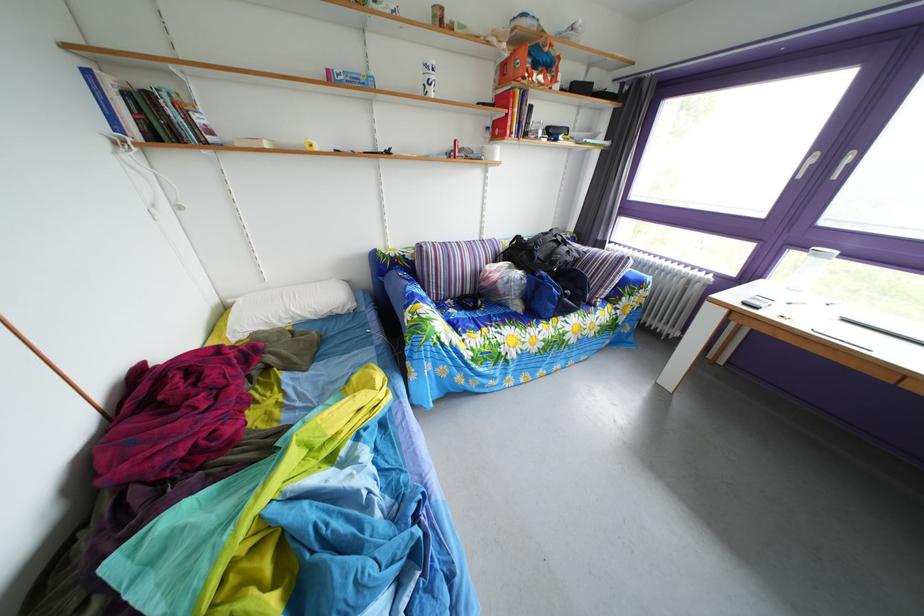
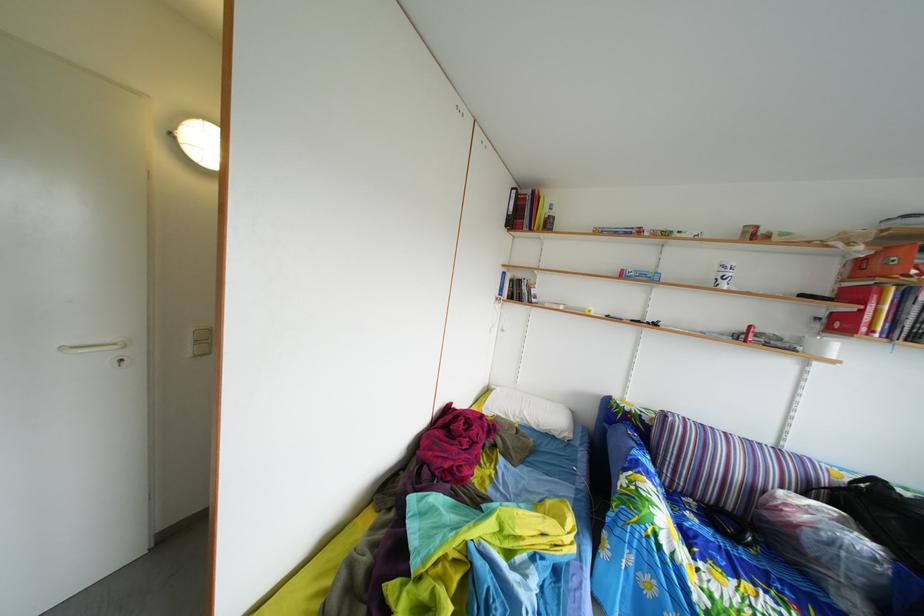
In the second image, find the point that corresponds to point (326, 323) in the first image.

(549, 434)